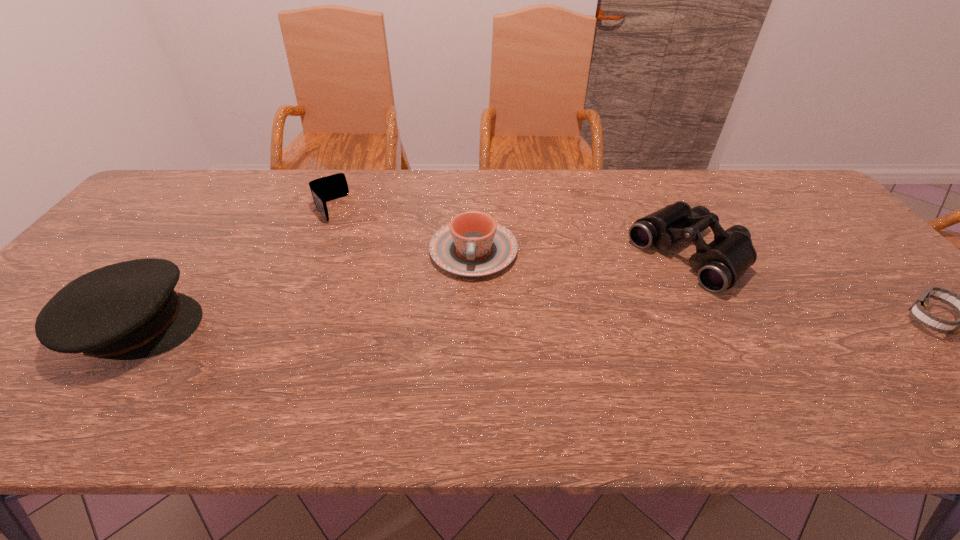
Where is `free spot on the desktop that is between the beret and the rightmost object and is positioned on the outer surface of the second object from left to right`? The image size is (960, 540). free spot on the desktop that is between the beret and the rightmost object and is positioned on the outer surface of the second object from left to right is located at coordinates [417, 324].

In order to click on vacant spot on the desktop that is between the leftmost object and the watch and is positioned on the front-facing side of the fourth object from left to right in this screenshot , I will do `click(597, 323)`.

Find the location of `free space on the desktop that is between the beret and the watch and is positioned on the handle side of the third object from left to right`. free space on the desktop that is between the beret and the watch and is positioned on the handle side of the third object from left to right is located at coordinates (465, 324).